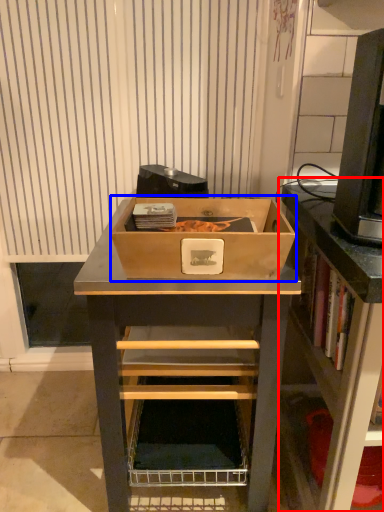
Question: Which point is further to the camera, shelf (highlighted by a red box) or box (highlighted by a blue box)?

Choices:
 (A) shelf
 (B) box

Answer: (B)